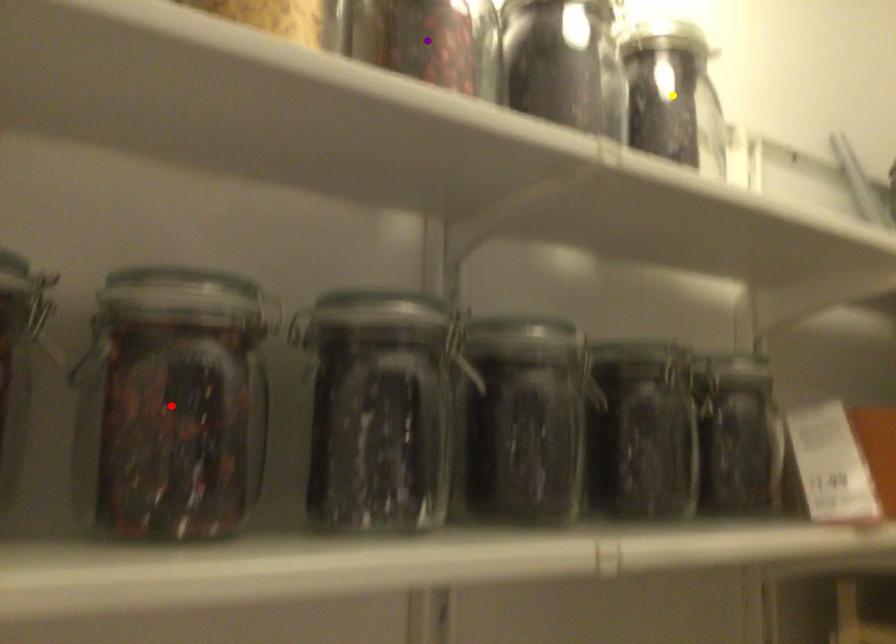
Order these from farthest to nearest:
yellow point
purple point
red point

yellow point
purple point
red point